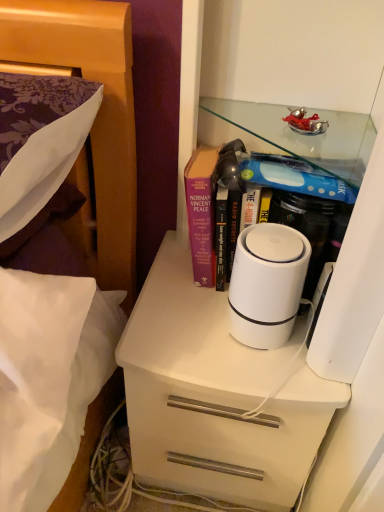
Locate an element on the screen. Image resolution: width=384 pixels, height=512 pixels. white glossy cabinet at center is located at coordinates (284, 50).

In order to click on white matte cylindrical device at center in this screenshot , I will do `click(267, 284)`.

Find the location of a particular element. The image size is (384, 512). hardcover book at center is located at coordinates (241, 193).

Does white matte chest of drawers at center lie behind white glossy cabinet at center?

Yes, it is.

Is white matte chest of drawers at center next to white glossy cabinet at center?

There is a gap between white matte chest of drawers at center and white glossy cabinet at center.

Considering the relative sizes of white matte chest of drawers at center and white glossy cabinet at center in the image provided, is white matte chest of drawers at center wider than white glossy cabinet at center?

Yes.

Could you tell me if white matte chest of drawers at center is turned towards white glossy cabinet at center?

No, white matte chest of drawers at center is not turned towards white glossy cabinet at center.

Who is bigger, hardcover book at center or white matte cylindrical device at center?

hardcover book at center is bigger.

Measure the distance from hardcover book at center to white matte cylindrical device at center.

The distance of hardcover book at center from white matte cylindrical device at center is 12.27 centimeters.

Would you say hardcover book at center is outside white matte cylindrical device at center?

Absolutely, hardcover book at center is external to white matte cylindrical device at center.

Is white matte cylindrical device at center facing away from white glossy cabinet at center?

Yes, white matte cylindrical device at center is positioned with its back facing white glossy cabinet at center.

From a real-world perspective, is white matte cylindrical device at center on white glossy cabinet at center?

No, from a real-world perspective, white matte cylindrical device at center is not above white glossy cabinet at center.

Can you confirm if white matte cylindrical device at center is wider than white glossy cabinet at center?

No, white matte cylindrical device at center is not wider than white glossy cabinet at center.

Between white matte cylindrical device at center and white glossy cabinet at center, which one has larger size?

white glossy cabinet at center is bigger.

From the image's perspective, is white matte cylindrical device at center located above hardcover book at center?

No, from the image's perspective, white matte cylindrical device at center is not over hardcover book at center.

Consider the image. Is white matte cylindrical device at center positioned far away from hardcover book at center?

No.

Looking at the image, does white matte cylindrical device at center seem bigger or smaller compared to hardcover book at center?

Clearly, white matte cylindrical device at center is smaller in size than hardcover book at center.

Is white matte cylindrical device at center positioned behind hardcover book at center?

No, white matte cylindrical device at center is in front of hardcover book at center.

In the scene shown: From a real-world perspective, which is physically below, white matte chest of drawers at center or white matte cylindrical device at center?

white matte chest of drawers at center is physically lower.

From the image's perspective, which one is positioned lower, white matte chest of drawers at center or white matte cylindrical device at center?

white matte chest of drawers at center.

Between white matte chest of drawers at center and white matte cylindrical device at center, which one has smaller width?

Thinner between the two is white matte cylindrical device at center.

Considering the positions of points (258, 428) and (282, 234), is point (258, 428) farther from camera compared to point (282, 234)?

Yes.

From a real-world perspective, is white matte cylindrical device at center under white matte chest of drawers at center?

No, from a real-world perspective, white matte cylindrical device at center is not below white matte chest of drawers at center.

Between white matte cylindrical device at center and white matte chest of drawers at center, which one appears on the right side from the viewer's perspective?

white matte cylindrical device at center.

Is white matte cylindrical device at center shorter than white matte chest of drawers at center?

Correct, white matte cylindrical device at center is not as tall as white matte chest of drawers at center.

Is white glossy cabinet at center facing towards hardcover book at center?

Yes, white glossy cabinet at center is aimed at hardcover book at center.

From the image's perspective, is white glossy cabinet at center under hardcover book at center?

No, from the image's perspective, white glossy cabinet at center is not below hardcover book at center.

Looking at this image, how different are the orientations of white glossy cabinet at center and hardcover book at center in degrees?

There is a 2.39-degree angle between the facing directions of white glossy cabinet at center and hardcover book at center.

Which is more to the left, white glossy cabinet at center or hardcover book at center?

white glossy cabinet at center.

Find the location of a particular element. The width and height of the screenshot is (384, 512). the chest of drawers that appears behind the white glossy cabinet at center is located at coordinates click(x=216, y=396).

In order to click on book located above the white matte cylindrical device at center (from a real-world perspective) in this screenshot , I will do `click(241, 193)`.

When comparing their distances from white matte chest of drawers at center, does hardcover book at center or white matte cylindrical device at center seem further?

hardcover book at center is positioned further to the anchor white matte chest of drawers at center.

Based on their spatial positions, is white matte cylindrical device at center or hardcover book at center closer to white matte chest of drawers at center?

white matte cylindrical device at center is positioned closer to the anchor white matte chest of drawers at center.

Estimate the real-world distances between objects in this image. Which object is further from white matte cylindrical device at center, white matte chest of drawers at center or white glossy cabinet at center?

white glossy cabinet at center is further to white matte cylindrical device at center.

From the picture: When comparing their distances from white matte cylindrical device at center, does white matte chest of drawers at center or hardcover book at center seem closer?

hardcover book at center is positioned closer to the anchor white matte cylindrical device at center.

From the picture: From the image, which object appears to be nearer to white glossy cabinet at center, white matte cylindrical device at center or hardcover book at center?

Among the two, hardcover book at center is located nearer to white glossy cabinet at center.

Looking at the image, which one is located further to hardcover book at center, white glossy cabinet at center or white matte cylindrical device at center?

white glossy cabinet at center.

Considering their positions, is hardcover book at center positioned further to white matte chest of drawers at center than white glossy cabinet at center?

The object further to white matte chest of drawers at center is white glossy cabinet at center.

Considering their positions, is white matte cylindrical device at center positioned closer to white glossy cabinet at center than white matte chest of drawers at center?

white matte cylindrical device at center lies closer to white glossy cabinet at center than the other object.

Find the location of a particular element. home appliance between white glossy cabinet at center and white matte chest of drawers at center vertically is located at coordinates (267, 284).

The width and height of the screenshot is (384, 512). In order to click on home appliance between hardcover book at center and white matte chest of drawers at center in the vertical direction in this screenshot , I will do [x=267, y=284].

Where is `home appliance between white glossy cabinet at center and hardcover book at center in the front-back direction`? home appliance between white glossy cabinet at center and hardcover book at center in the front-back direction is located at coordinates (267, 284).

The height and width of the screenshot is (512, 384). Find the location of `book between white glossy cabinet at center and white matte chest of drawers at center vertically`. book between white glossy cabinet at center and white matte chest of drawers at center vertically is located at coordinates (241, 193).